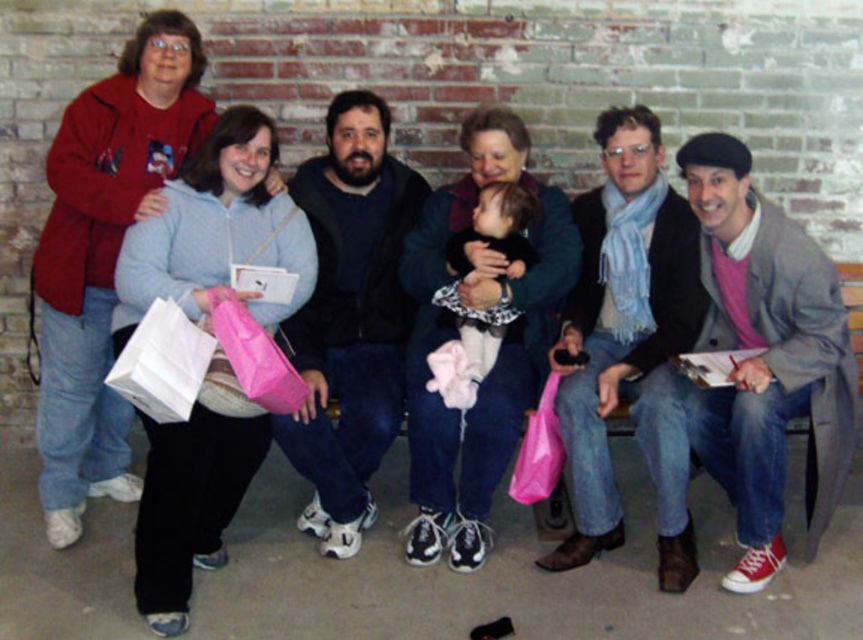
Question: Is blue scarf at center wider than dark blue fleece at center?

Choices:
 (A) no
 (B) yes

Answer: (B)

Question: Which point is farther to the camera?

Choices:
 (A) (300, 438)
 (B) (779, 372)

Answer: (A)

Question: Can you confirm if pink wool sweater at right is wider than light blue fleece sweater at upper left?

Choices:
 (A) no
 (B) yes

Answer: (B)

Question: Among these points, which one is farthest from the camera?

Choices:
 (A) (319, 180)
 (B) (608, 403)

Answer: (A)

Question: Estimate the real-world distances between objects in this image. Which object is farther from the fluffy pink blanket at center?

Choices:
 (A) pink wool sweater at right
 (B) blue scarf at center
 (C) light blue fleece sweater at upper left
 (D) dark blue fleece at center

Answer: (A)

Question: Is pink wool sweater at right wider than fluffy pink blanket at center?

Choices:
 (A) yes
 (B) no

Answer: (A)